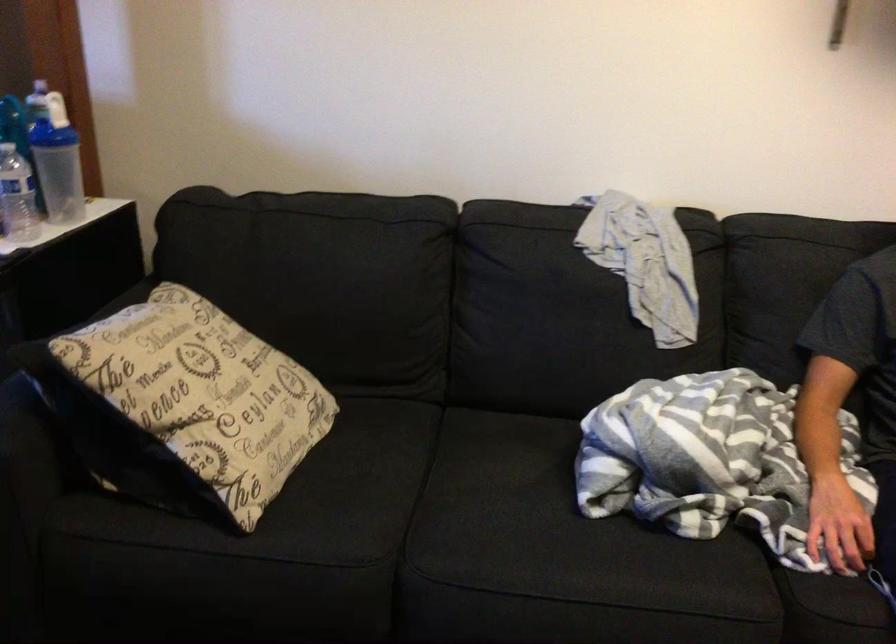
In order to click on clear water bottle in this screenshot , I will do `click(16, 196)`.